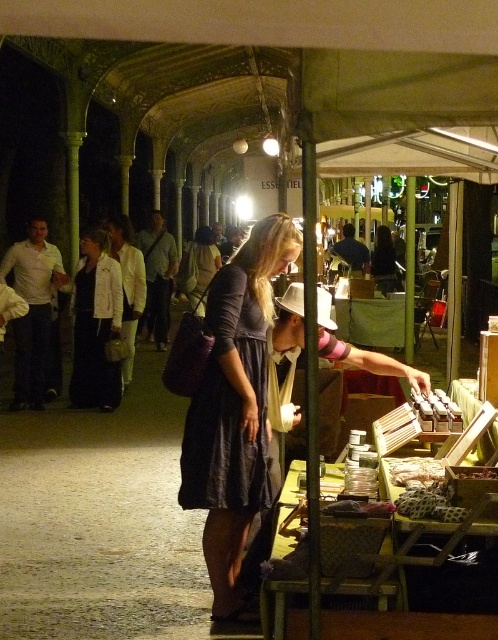
Which is more to the right, dark gray dress at center or matte black dress at center?

From the viewer's perspective, dark gray dress at center appears more on the right side.

Does dark gray dress at center have a lesser width compared to matte black dress at center?

Yes.

The width and height of the screenshot is (498, 640). What are the coordinates of `dark gray dress at center` in the screenshot? It's located at click(234, 406).

I want to click on dark gray dress at center, so click(234, 406).

Does point (237, 416) lie behind point (116, 403)?

No.

Who is shorter, dark blue fabric dress at center or matte black dress at center?

dark blue fabric dress at center

I want to click on dark blue fabric dress at center, so click(x=227, y=404).

Is dark gray dress at center wider than dark blue fabric dress at center?

Yes.

Who is lower down, dark gray dress at center or dark blue fabric dress at center?

dark gray dress at center is below.

Where is `dark gray dress at center`? dark gray dress at center is located at coordinates (234, 406).

I want to click on dark gray dress at center, so click(x=234, y=406).